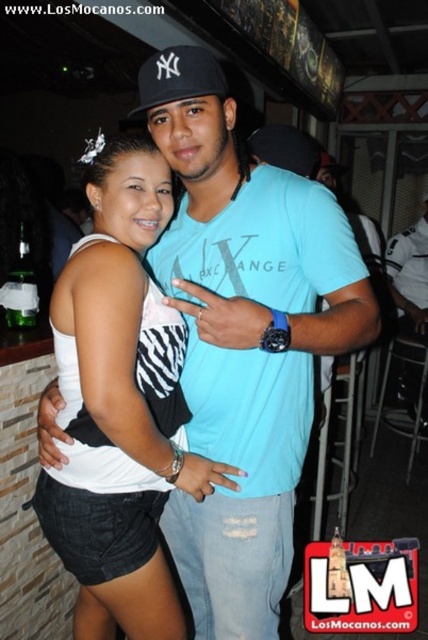
Where is the white denim shorts at center located in the image?

The white denim shorts at center is located at point (125, 314).

You are a photographer at the bar and want to ensure both the white denim shorts at center and the black fabric baseball cap at upper center are visible in your shot. Given their positions and sizes, which object will appear larger in the final photo?

The white denim shorts at center will appear larger in the final photo because it has a greater height compared to the black fabric baseball cap at upper center.